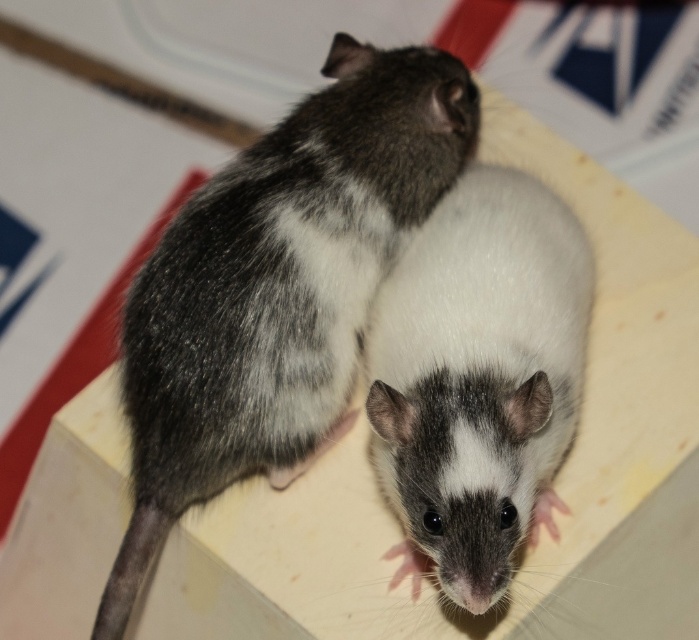
Does gray-furred mouse at center have a larger size compared to white fur mouse at center?

Yes, gray-furred mouse at center is bigger than white fur mouse at center.

Does gray-furred mouse at center have a greater height compared to white fur mouse at center?

Yes, gray-furred mouse at center is taller than white fur mouse at center.

Where is `gray-furred mouse at center`? The width and height of the screenshot is (699, 640). gray-furred mouse at center is located at coordinates (278, 289).